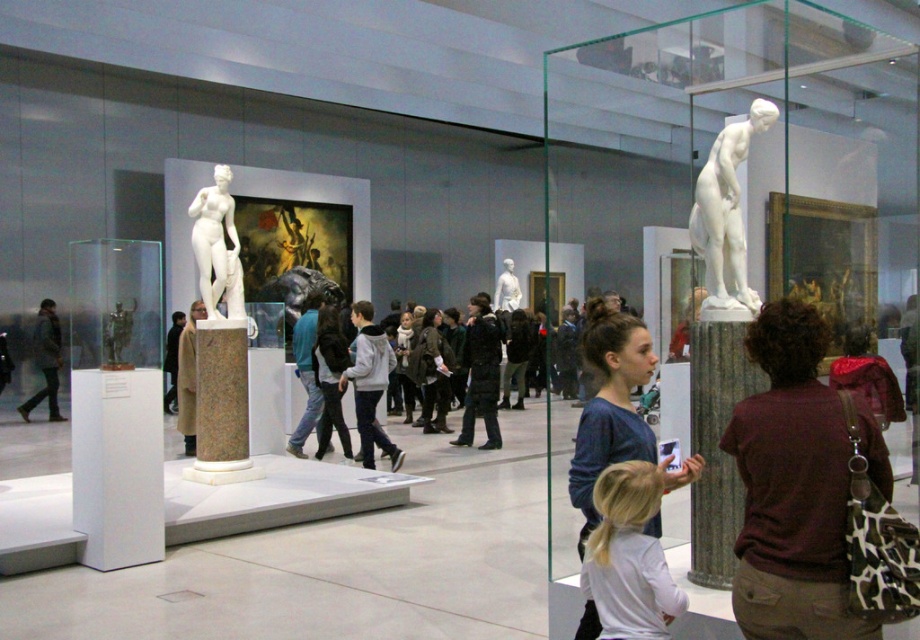
Between point (698, 570) and point (210, 259), which one is positioned in front?

Point (698, 570) is more forward.

The image size is (920, 640). What do you see at coordinates (716, 444) in the screenshot?
I see `green marble pillar at lower right` at bounding box center [716, 444].

At what (x,y) coordinates should I click in order to perform the action: click on green marble pillar at lower right. Please return your answer as a coordinate pair (x, y). This screenshot has width=920, height=640. Looking at the image, I should click on (716, 444).

Is white marble statue at upper right above white marble statue at left?

Yes, white marble statue at upper right is above white marble statue at left.

Can you confirm if white marble statue at upper right is smaller than white marble statue at left?

Actually, white marble statue at upper right might be larger than white marble statue at left.

Find the location of a particular element. The image size is (920, 640). white marble statue at upper right is located at coordinates (726, 216).

Between maroon fabric shirt at right and white marble statue at center, which one has more height?

white marble statue at center is taller.

The height and width of the screenshot is (640, 920). Describe the element at coordinates (792, 486) in the screenshot. I see `maroon fabric shirt at right` at that location.

What do you see at coordinates (792, 486) in the screenshot? I see `maroon fabric shirt at right` at bounding box center [792, 486].

The image size is (920, 640). In order to click on maroon fabric shirt at right in this screenshot , I will do [x=792, y=486].